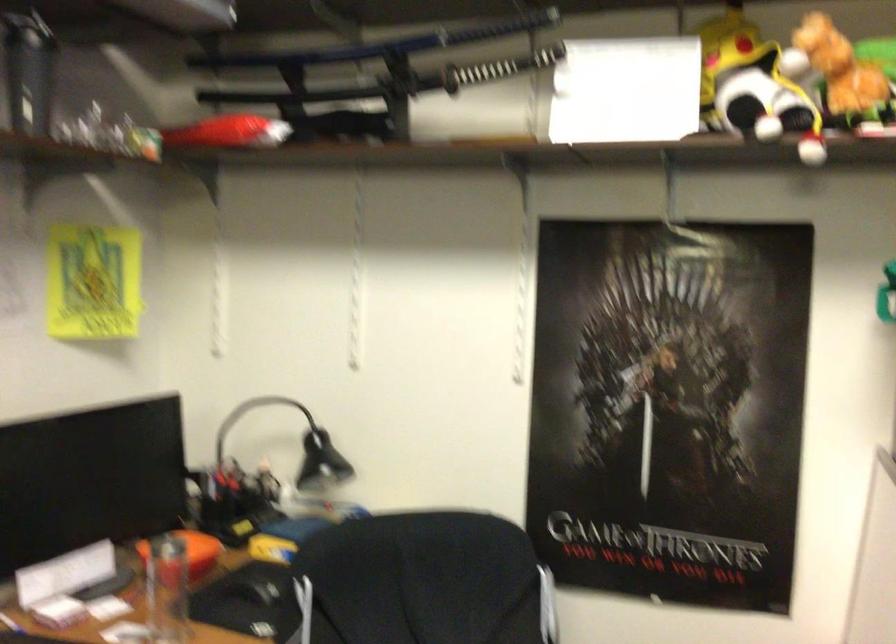
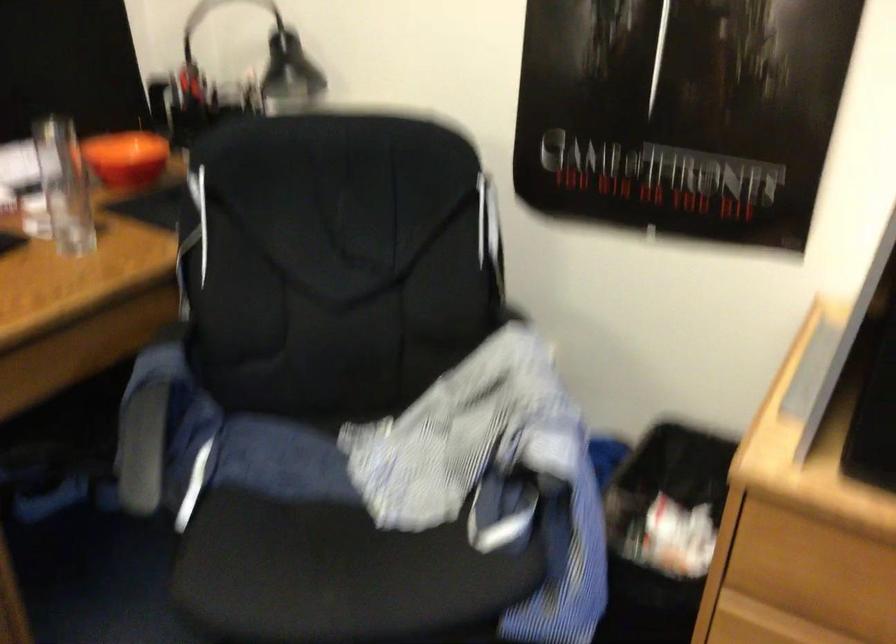
The images are taken continuously from a first-person perspective. In which direction are you moving?

The cameraman walked toward right, forward.